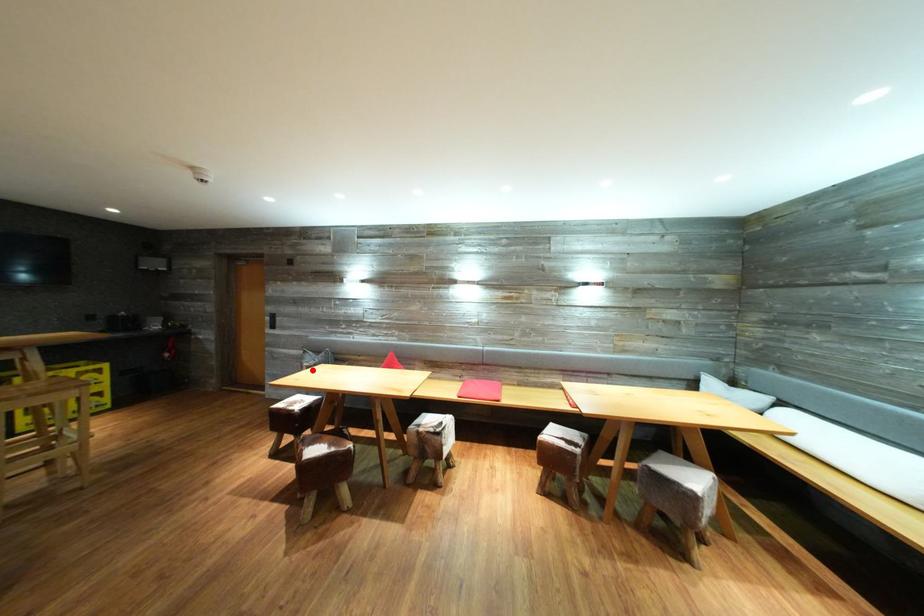
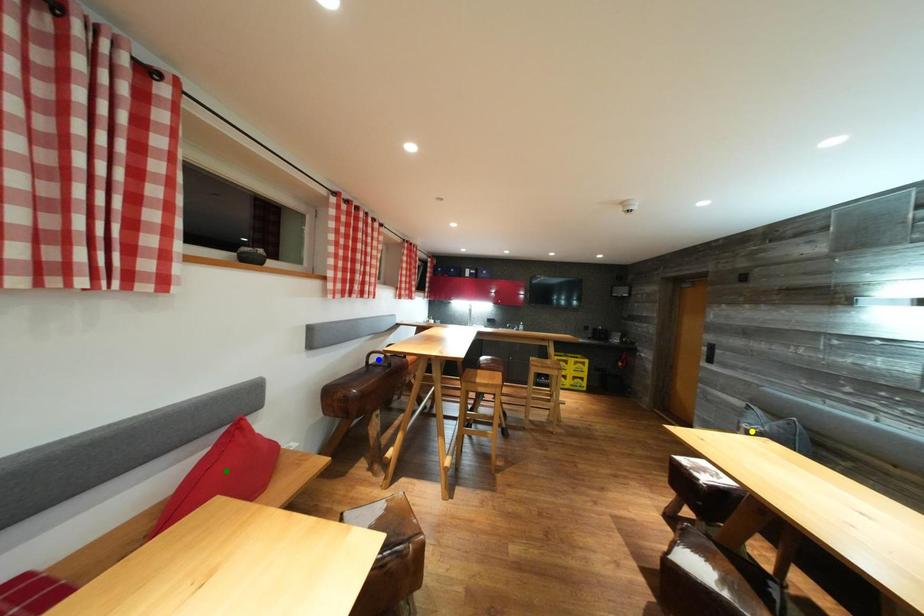
Question: I am providing you with two images of the same scene from different viewpoints. A red point is marked on the first image. You are given multiple points on the second image. Which spot in image 2 lines up with the point in image 1?

Choices:
 (A) blue point
 (B) yellow point
 (C) green point

Answer: (B)